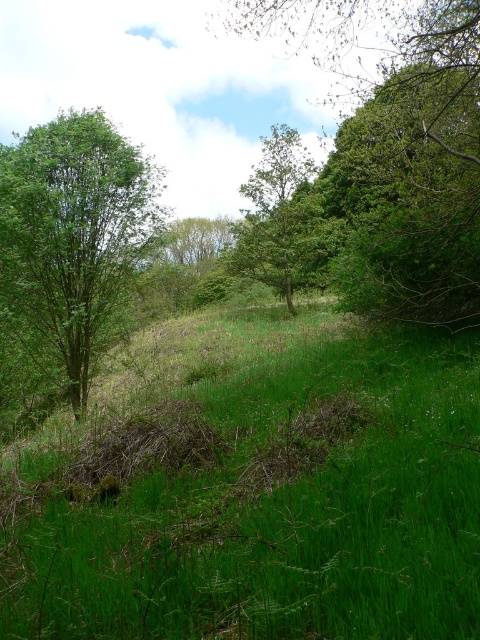
Question: Which object is closer to the camera taking this photo?

Choices:
 (A) green leafy tree at left
 (B) green leafy tree at center

Answer: (A)

Question: Among these points, which one is farthest from the camera?

Choices:
 (A) (76, 356)
 (B) (374, 182)
 (C) (251, 221)
 (D) (143, 481)

Answer: (C)

Question: Which object is closer to the camera taking this photo?

Choices:
 (A) green leafy tree at center
 (B) green grassy at center
 (C) green leafy tree at upper center
 (D) green leafy tree at left

Answer: (B)

Question: Where is green grassy at center located in relation to green leafy tree at center in the image?

Choices:
 (A) left
 (B) right

Answer: (A)

Question: Can you confirm if green grassy at center is positioned below green leafy tree at center?

Choices:
 (A) yes
 (B) no

Answer: (A)

Question: Can you confirm if green grassy at center is thinner than green leafy tree at left?

Choices:
 (A) yes
 (B) no

Answer: (B)